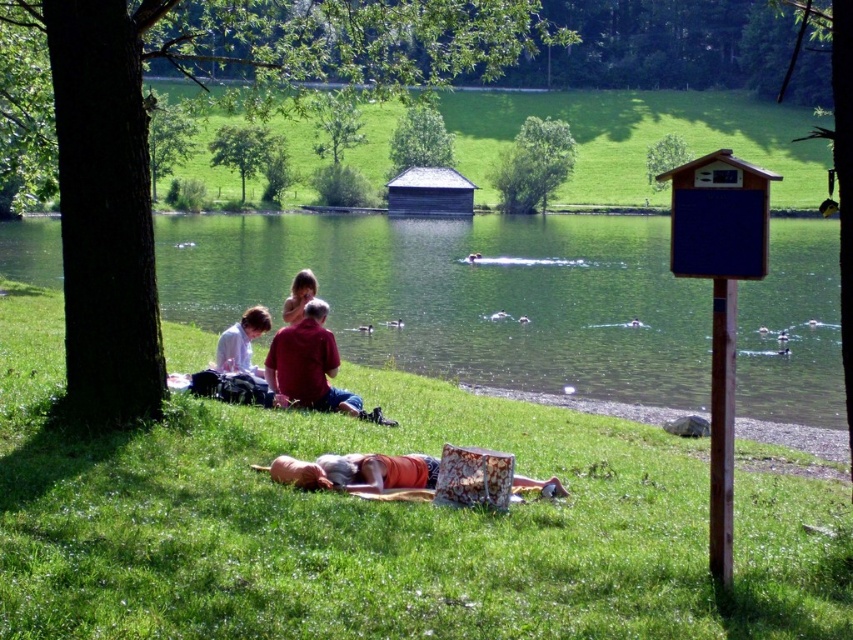
Question: Which of the following is the farthest from the observer?

Choices:
 (A) red shirt at center
 (B) white paper at lower left
 (C) green smooth water at center

Answer: (B)

Question: Is green grass at center further to the viewer compared to smooth skin child at center?

Choices:
 (A) yes
 (B) no

Answer: (B)

Question: Which is farther from the red shirt at center?

Choices:
 (A) green smooth water at center
 (B) green grass at center
 (C) orange cotton shirt at lower center

Answer: (B)

Question: Does green grass at center appear under white paper at lower left?

Choices:
 (A) yes
 (B) no

Answer: (B)

Question: Estimate the real-world distances between objects in this image. Which object is farther from the green grass at lower left?

Choices:
 (A) white paper at lower left
 (B) red shirt at center

Answer: (A)

Question: Is green grass at center above orange cotton shirt at lower center?

Choices:
 (A) yes
 (B) no

Answer: (A)